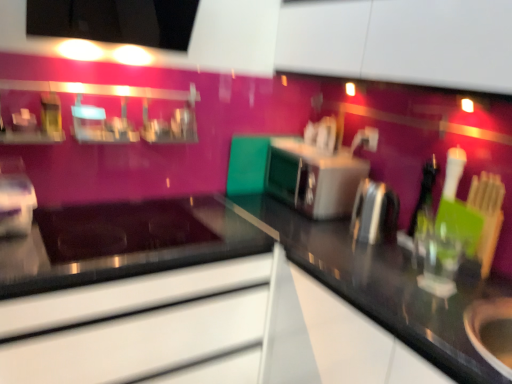
Question: In terms of height, does metallic silver kettle at right, which is the third appliance in left-to-right order, look taller or shorter compared to black glossy countertop at center?

Choices:
 (A) short
 (B) tall

Answer: (A)

Question: From a real-world perspective, is metallic silver kettle at right, the first appliance positioned from the right, physically located above or below black glossy countertop at center?

Choices:
 (A) below
 (B) above

Answer: (B)

Question: Estimate the real-world distances between objects in this image. Which object is closer to the plastic container at lower left, which is the second appliance from front to back?

Choices:
 (A) metallic silver oven at center
 (B) metallic silver kettle at right, the first appliance positioned from the right
 (C) black glossy countertop at center
 (D) satin silver toaster at center, acting as the second appliance starting from the left

Answer: (C)

Question: Which object is positioned farthest from the satin silver toaster at center, positioned as the 3th appliance in front-to-back order?

Choices:
 (A) metallic silver oven at center
 (B) black glossy countertop at center
 (C) metallic silver kettle at right, positioned as the third appliance in back-to-front order
 (D) plastic container at lower left, positioned as the 3th appliance in right-to-left order

Answer: (D)